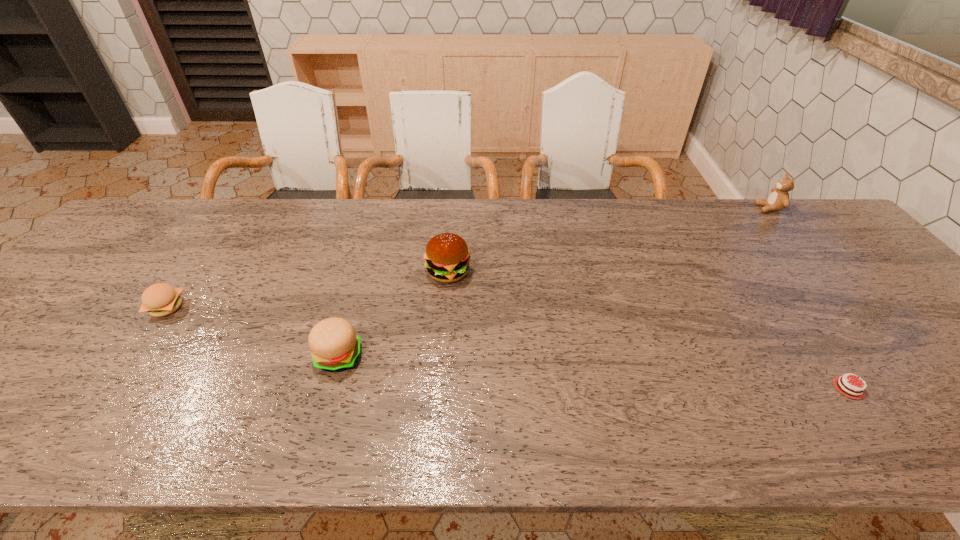
Find the location of `free space located 0.340m on the front-facing side of the rightmost object`. free space located 0.340m on the front-facing side of the rightmost object is located at coordinates (653, 208).

This screenshot has height=540, width=960. I want to click on free space located on the front-facing side of the rightmost object, so click(735, 208).

In order to click on vacant space located 0.180m on the front-facing side of the rightmost object in this screenshot , I will do `click(702, 208)`.

You are a GUI agent. You are given a task and a screenshot of the screen. Output one action in this format:
    pyautogui.click(x=<x>, y=<y>)
    Task: Click on the vacant area situated on the front of the rightmost hamburger
    The image size is (960, 540).
    Given the screenshot: What is the action you would take?
    pyautogui.click(x=445, y=305)

Find the location of `free space located on the left of the second shortest hamburger`. free space located on the left of the second shortest hamburger is located at coordinates (245, 356).

Where is `blank space located 0.130m on the right of the shortest hamburger`? blank space located 0.130m on the right of the shortest hamburger is located at coordinates (234, 307).

Locate an element on the screen. vacant area situated 0.220m on the back of the shortest object is located at coordinates (780, 290).

This screenshot has width=960, height=540. I want to click on object that is positioned at the far edge, so click(x=778, y=200).

Find the location of a particular element. The image size is (960, 540). object at the near edge is located at coordinates (862, 396).

The image size is (960, 540). In order to click on object situated at the right edge in this screenshot , I will do `click(778, 200)`.